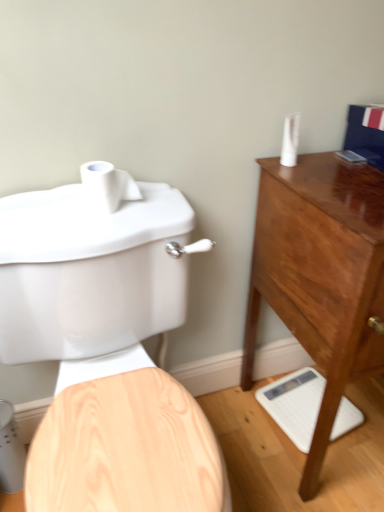
Question: Does matte white toilet at left have a larger size compared to white matte toilet paper at upper left?

Choices:
 (A) no
 (B) yes

Answer: (B)

Question: Is white matte toilet paper at upper left inside matte white toilet at left?

Choices:
 (A) yes
 (B) no

Answer: (B)

Question: Is matte white toilet at left touching white matte toilet paper at upper left?

Choices:
 (A) no
 (B) yes

Answer: (A)

Question: Is matte white toilet at left positioned behind white matte toilet paper at upper left?

Choices:
 (A) yes
 (B) no

Answer: (B)

Question: Does matte white toilet at left have a greater width compared to white matte toilet paper at upper left?

Choices:
 (A) yes
 (B) no

Answer: (A)

Question: Does matte white toilet at left turn towards white matte toilet paper at upper left?

Choices:
 (A) yes
 (B) no

Answer: (B)

Question: Can you confirm if mahogany wood chest of drawers at right is shorter than white glossy scale at lower right?

Choices:
 (A) no
 (B) yes

Answer: (A)

Question: Can you confirm if mahogany wood chest of drawers at right is taller than white glossy scale at lower right?

Choices:
 (A) no
 (B) yes

Answer: (B)

Question: Does mahogany wood chest of drawers at right have a greater width compared to white glossy scale at lower right?

Choices:
 (A) yes
 (B) no

Answer: (A)

Question: From a real-world perspective, is mahogany wood chest of drawers at right on white glossy scale at lower right?

Choices:
 (A) yes
 (B) no

Answer: (A)

Question: Is mahogany wood chest of drawers at right to the right of white glossy scale at lower right from the viewer's perspective?

Choices:
 (A) yes
 (B) no

Answer: (A)

Question: Can you confirm if mahogany wood chest of drawers at right is bigger than white glossy scale at lower right?

Choices:
 (A) yes
 (B) no

Answer: (A)

Question: Is white matte toilet paper at upper left next to white glossy scale at lower right?

Choices:
 (A) yes
 (B) no

Answer: (B)